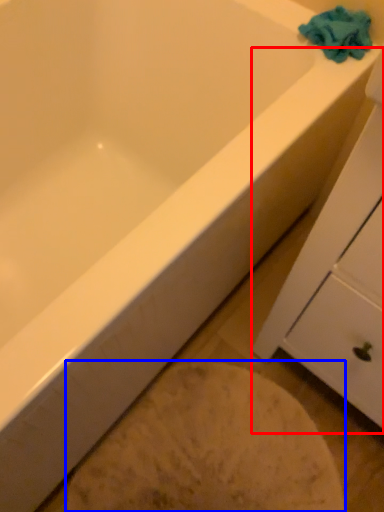
Question: Which point is closer to the camera, cabinetry (highlighted by a red box) or porcelain (highlighted by a blue box)?

Choices:
 (A) cabinetry
 (B) porcelain

Answer: (A)